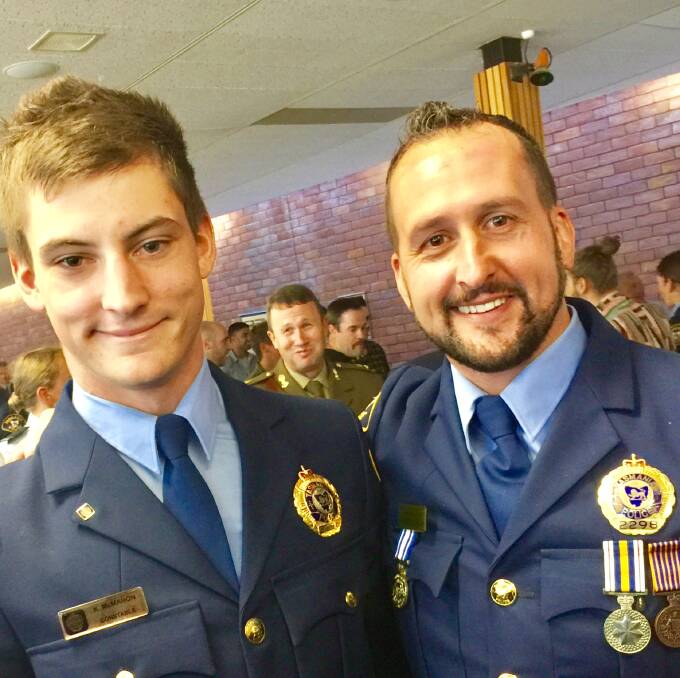
Identify the location of brick wall. This screenshot has width=680, height=678. (347, 238).